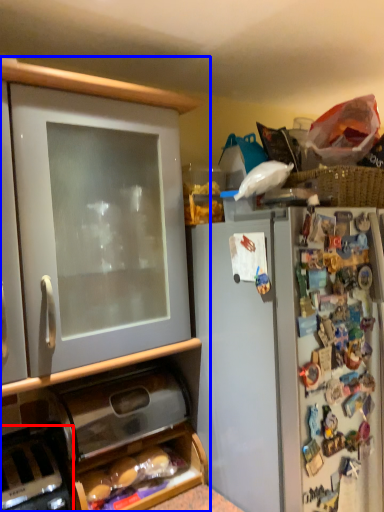
Question: Which point is closer to the camera, appliance (highlighted by a red box) or cabinetry (highlighted by a blue box)?

Choices:
 (A) appliance
 (B) cabinetry

Answer: (B)